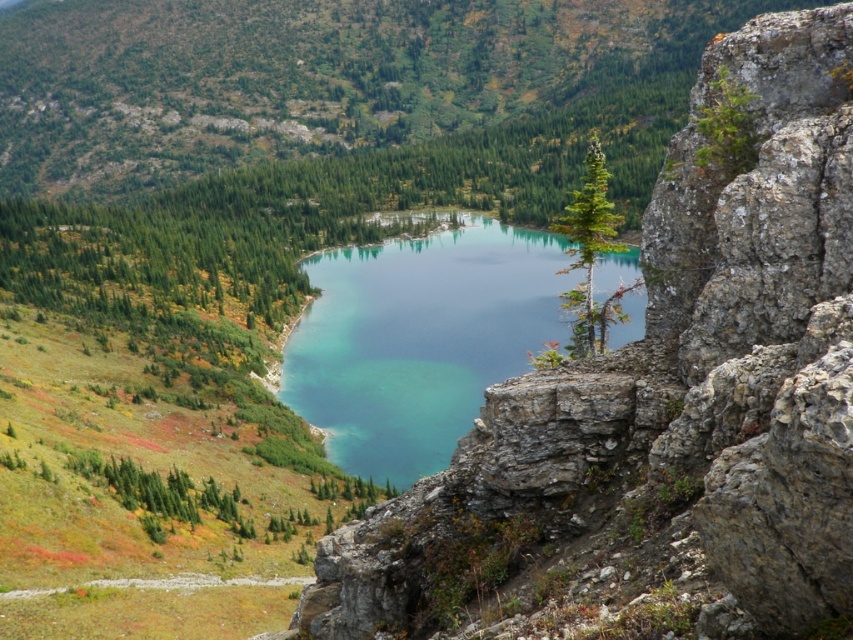
In the scene shown: You are a hiker standing at the edge of the rugged rocky terrain in the foreground. You see the teal glassy water at center and the green matte tree at center. Which object is closer to you?

The teal glassy water at center is closer to you because it is in front of the green matte tree at center.

You are standing at the edge of the lake and want to take a photo of both point (425, 609) and point (329, 289). Which point will appear larger in your camera view?

Point (425, 609) is closer to the camera than point (329, 289), so it will appear larger in the photo.

You are a hiker who wants to take a photo of the rocky cliff at center and the teal glassy water at center. Which object appears taller in the photo?

The teal glassy water at center appears taller than the rocky cliff at center in the photo because the rocky cliff at center is shorter than teal glassy water at center.